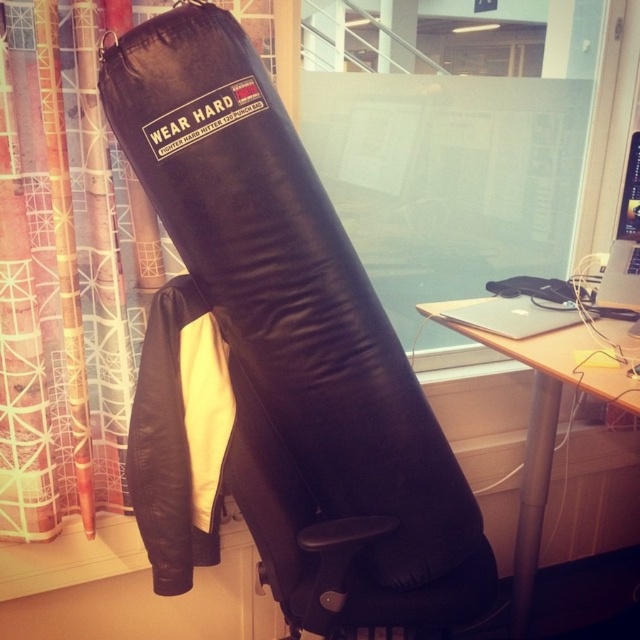
Question: Does black leather boxing glove at center appear over textured fabric curtain at left?

Choices:
 (A) no
 (B) yes

Answer: (A)

Question: Which object is positioned farthest from the wooden desk at center?

Choices:
 (A) textured fabric curtain at left
 (B) black leather boxing glove at center

Answer: (A)

Question: Considering the relative positions of black leather boxing glove at center and wooden desk at center in the image provided, where is black leather boxing glove at center located with respect to wooden desk at center?

Choices:
 (A) right
 (B) left

Answer: (B)

Question: Does textured fabric curtain at left come in front of wooden desk at center?

Choices:
 (A) no
 (B) yes

Answer: (A)

Question: Which object appears farthest from the camera in this image?

Choices:
 (A) black leather boxing glove at center
 (B) wooden desk at center
 (C) textured fabric curtain at left

Answer: (C)

Question: Which object is positioned closest to the textured fabric curtain at left?

Choices:
 (A) black leather boxing glove at center
 (B) wooden desk at center

Answer: (A)